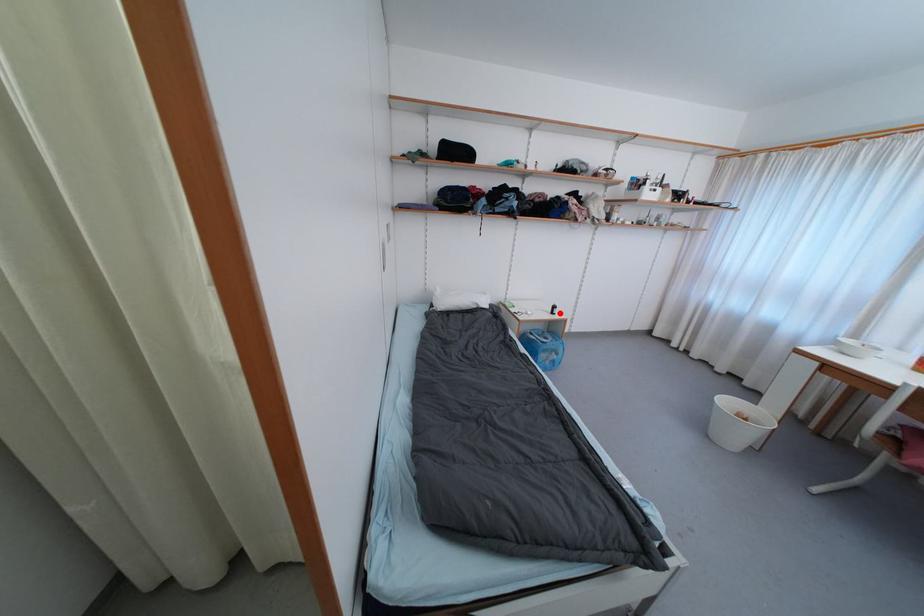
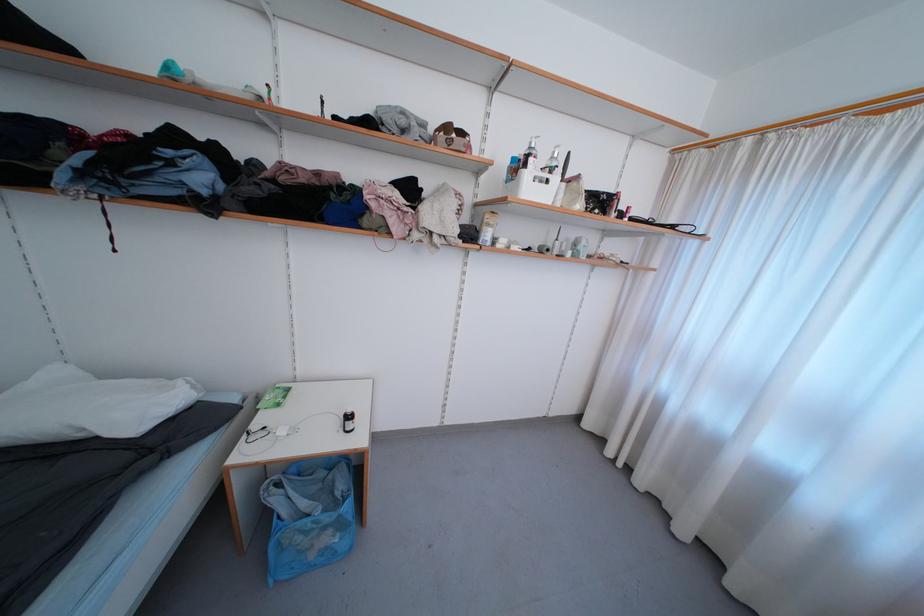
Question: I am providing you with two images of the same scene from different viewpoints. A red point is marked on the first image. Can you still see the location of the red point in image 2?

Choices:
 (A) Yes
 (B) No

Answer: (A)